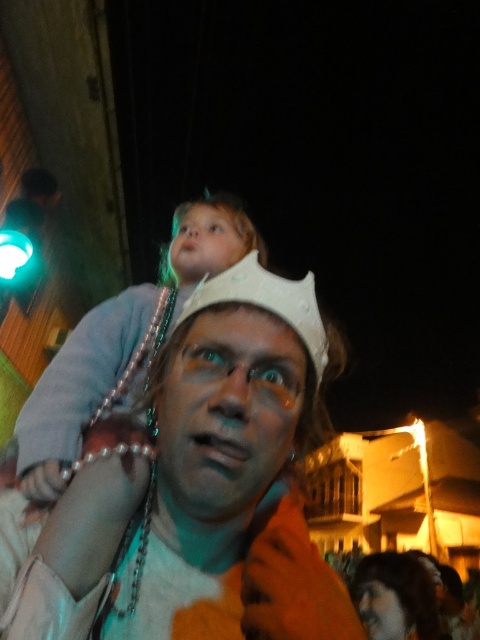
Question: Where is white pearl necklace at center located in relation to dark brown hair at lower right in the image?

Choices:
 (A) right
 (B) left

Answer: (B)

Question: Estimate the real-world distances between objects in this image. Which object is closer to the white pearl necklace at center?

Choices:
 (A) white matte crown at upper center
 (B) dark brown hair at lower right
 (C) smooth white crown at upper center

Answer: (A)

Question: Observing the image, what is the correct spatial positioning of dark brown hair at lower right in reference to smooth white crown at upper center?

Choices:
 (A) left
 (B) right

Answer: (B)

Question: Is white pearl necklace at center wider than dark brown hair at lower right?

Choices:
 (A) no
 (B) yes

Answer: (A)

Question: Which point is farther to the camera?

Choices:
 (A) (303, 296)
 (B) (381, 592)
 (C) (0, 582)

Answer: (B)

Question: Estimate the real-world distances between objects in this image. Which object is farther from the dark brown hair at lower right?

Choices:
 (A) smooth white crown at upper center
 (B) white pearl necklace at center
 (C) white matte crown at upper center

Answer: (A)